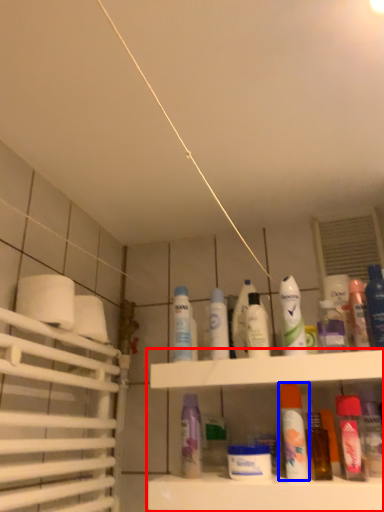
Question: Which point is further to the camera, shelf (highlighted by a red box) or mouthwash (highlighted by a blue box)?

Choices:
 (A) shelf
 (B) mouthwash

Answer: (B)